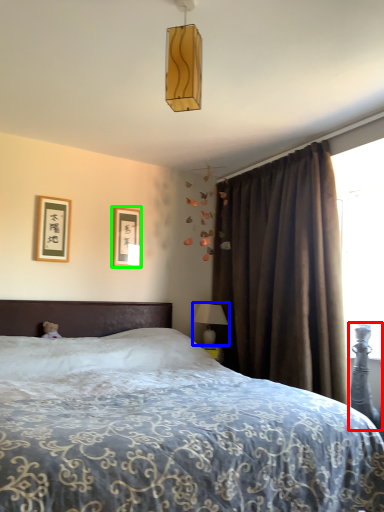
Question: Which is farther away from swivel chair (highlighted by a red box)? table lamp (highlighted by a blue box) or picture frame (highlighted by a green box)?

Choices:
 (A) table lamp
 (B) picture frame

Answer: (B)